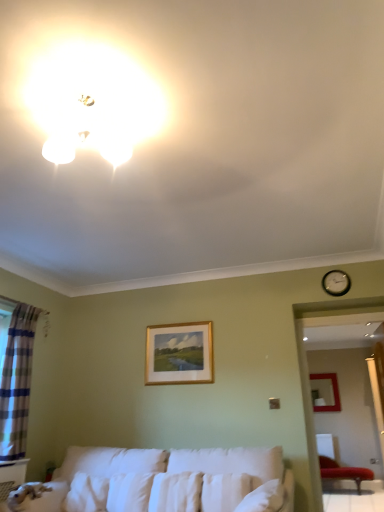
Question: Considering the relative sizes of velvet red chair at lower right and plaid fabric curtain at left in the image provided, is velvet red chair at lower right shorter than plaid fabric curtain at left?

Choices:
 (A) no
 (B) yes

Answer: (B)

Question: Can you confirm if velvet red chair at lower right is positioned to the left of plaid fabric curtain at left?

Choices:
 (A) no
 (B) yes

Answer: (A)

Question: Does velvet red chair at lower right turn towards plaid fabric curtain at left?

Choices:
 (A) yes
 (B) no

Answer: (A)

Question: Is velvet red chair at lower right looking in the opposite direction of plaid fabric curtain at left?

Choices:
 (A) yes
 (B) no

Answer: (B)

Question: Are velvet red chair at lower right and plaid fabric curtain at left located far from each other?

Choices:
 (A) yes
 (B) no

Answer: (A)

Question: Looking at their shapes, would you say white fabric couch at lower center is wider or thinner than plaid fabric curtain at left?

Choices:
 (A) wide
 (B) thin

Answer: (A)

Question: Would you say white fabric couch at lower center is to the left or to the right of plaid fabric curtain at left in the picture?

Choices:
 (A) left
 (B) right

Answer: (B)

Question: Does point (117, 461) appear closer or farther from the camera than point (4, 389)?

Choices:
 (A) farther
 (B) closer

Answer: (A)

Question: From a real-world perspective, is white fabric couch at lower center positioned above or below plaid fabric curtain at left?

Choices:
 (A) below
 (B) above

Answer: (A)

Question: Based on their positions, is matte white light fixture at upper left located to the left or right of black metal clock at upper right?

Choices:
 (A) left
 (B) right

Answer: (A)

Question: Do you think matte white light fixture at upper left is within black metal clock at upper right, or outside of it?

Choices:
 (A) inside
 (B) outside

Answer: (B)

Question: From a real-world perspective, relative to black metal clock at upper right, is matte white light fixture at upper left vertically above or below?

Choices:
 (A) above
 (B) below

Answer: (A)

Question: From the image's perspective, is matte white light fixture at upper left located above or below black metal clock at upper right?

Choices:
 (A) below
 (B) above

Answer: (B)

Question: In terms of width, does plaid fabric curtain at left look wider or thinner when compared to matte gold picture frame at center-right, the 1th picture frame viewed from the right?

Choices:
 (A) thin
 (B) wide

Answer: (B)

Question: In the image, is plaid fabric curtain at left positioned in front of or behind matte gold picture frame at center-right, the 1th picture frame from the back?

Choices:
 (A) behind
 (B) front

Answer: (B)